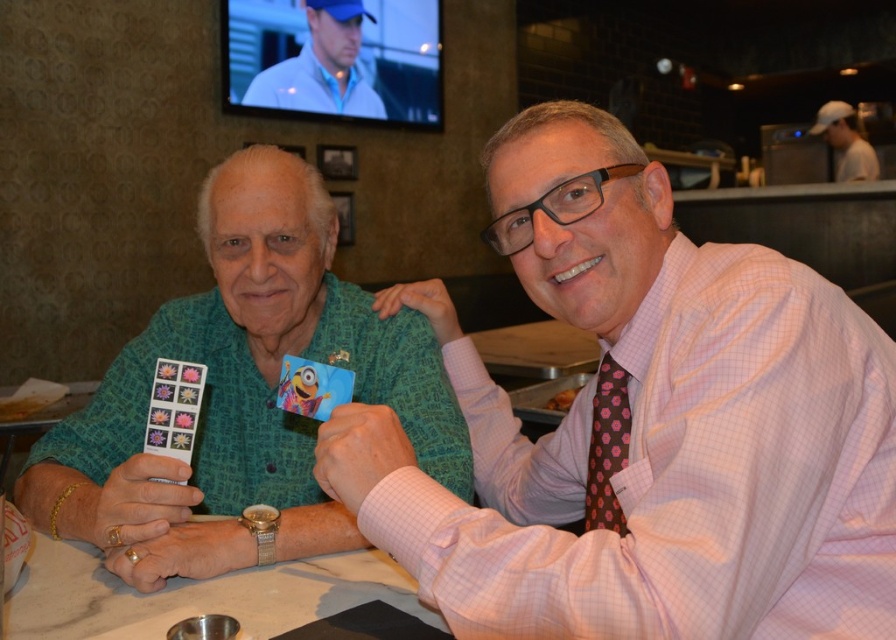
Is blue fabric shirt at upper center above white cap at upper right?

Correct, blue fabric shirt at upper center is located above white cap at upper right.

Can you confirm if blue fabric shirt at upper center is positioned below white cap at upper right?

Incorrect, blue fabric shirt at upper center is not positioned below white cap at upper right.

Is point (373, 104) farther from viewer compared to point (842, 112)?

No, it is not.

You are a GUI agent. You are given a task and a screenshot of the screen. Output one action in this format:
    pyautogui.click(x=<x>, y=<y>)
    Task: Click on the blue fabric shirt at upper center
    This screenshot has width=896, height=640.
    Given the screenshot: What is the action you would take?
    pyautogui.click(x=321, y=67)

Does green textured shirt at left lie behind pink floral silk tie at right?

Yes, green textured shirt at left is behind pink floral silk tie at right.

Is green textured shirt at left wider than pink floral silk tie at right?

Yes, green textured shirt at left is wider than pink floral silk tie at right.

Is point (211, 266) positioned behind point (606, 500)?

Yes.

The height and width of the screenshot is (640, 896). I want to click on green textured shirt at left, so click(240, 396).

Which is below, white marble table at center or white cap at upper right?

Positioned lower is white marble table at center.

Who is taller, white marble table at center or white cap at upper right?

With more height is white cap at upper right.

Is point (26, 582) positioned after point (823, 106)?

No, it is not.

Locate an element on the screen. white marble table at center is located at coordinates (195, 595).